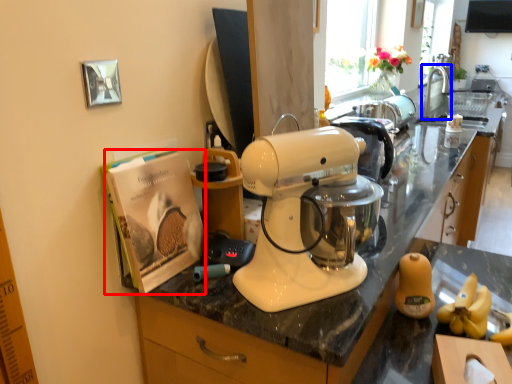
Question: Among these objects, which one is farthest to the camera, magazine (highlighted by a red box) or faucet (highlighted by a blue box)?

Choices:
 (A) magazine
 (B) faucet

Answer: (B)